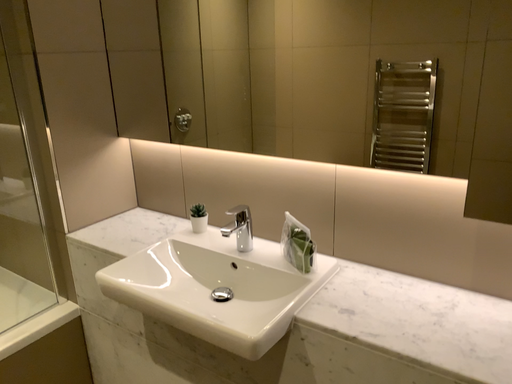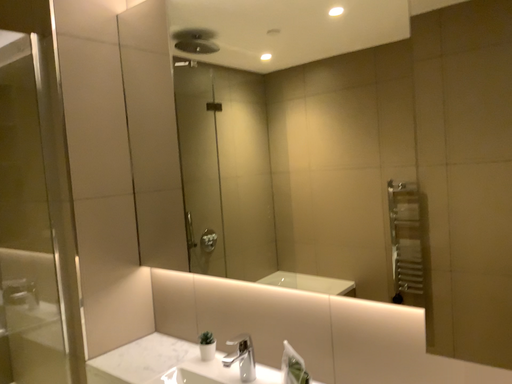
Question: How did the camera likely rotate when shooting the video?

Choices:
 (A) rotated upward
 (B) rotated downward

Answer: (A)